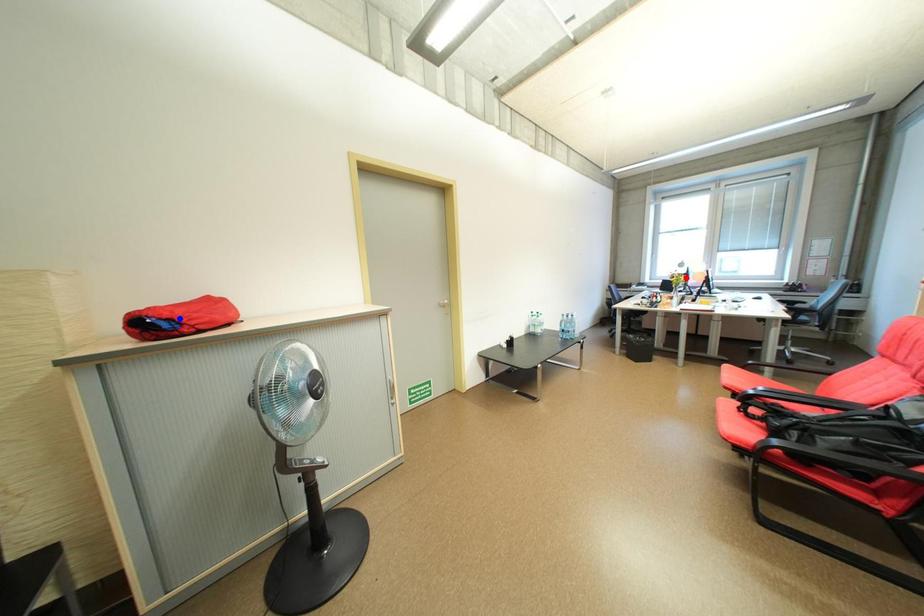
Question: Which of the two points in the image is closer to the camera?

Choices:
 (A) Blue point is closer.
 (B) Red point is closer.

Answer: (A)